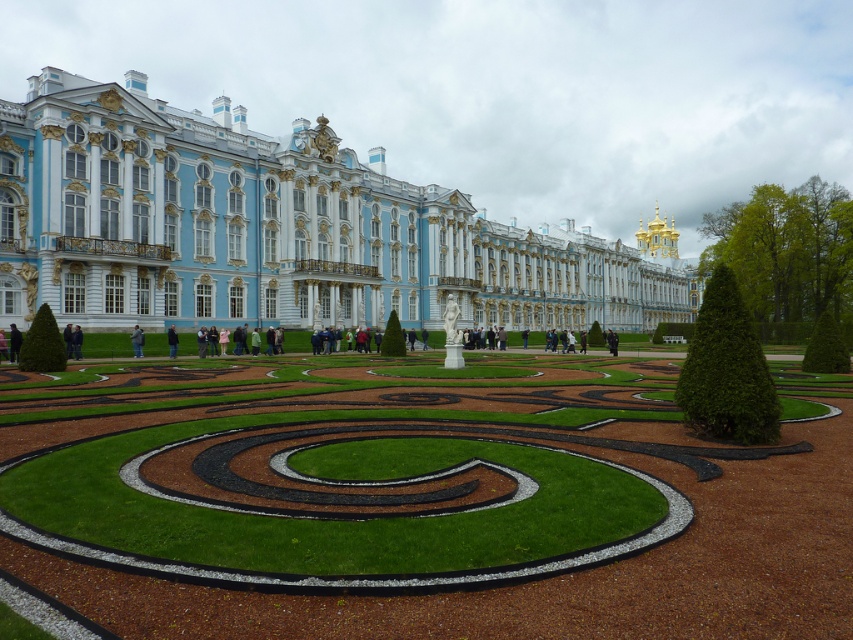
Between point (415, 564) and point (132, 342), which one is positioned behind?

Positioned behind is point (132, 342).

Can you confirm if green grass at center is taller than dark blue jeans at center?

Yes, green grass at center is taller than dark blue jeans at center.

Between point (845, 580) and point (138, 349), which one is positioned in front?

Point (845, 580) is in front.

I want to click on green grass at center, so click(416, 500).

Is white glossy palace at center below dark blue fabric jacket at lower left?

No, white glossy palace at center is not below dark blue fabric jacket at lower left.

Does white glossy palace at center have a lesser height compared to dark blue fabric jacket at lower left?

No.

What do you see at coordinates (280, 228) in the screenshot? The width and height of the screenshot is (853, 640). I see `white glossy palace at center` at bounding box center [280, 228].

Where is `white glossy palace at center`? The width and height of the screenshot is (853, 640). white glossy palace at center is located at coordinates (280, 228).

Is the position of white glossy palace at center less distant than that of dark blue jeans at center?

Yes, it is in front of dark blue jeans at center.

Does white glossy palace at center have a greater height compared to dark blue jeans at center?

Yes, white glossy palace at center is taller than dark blue jeans at center.

Where is `white glossy palace at center`? The width and height of the screenshot is (853, 640). white glossy palace at center is located at coordinates (280, 228).